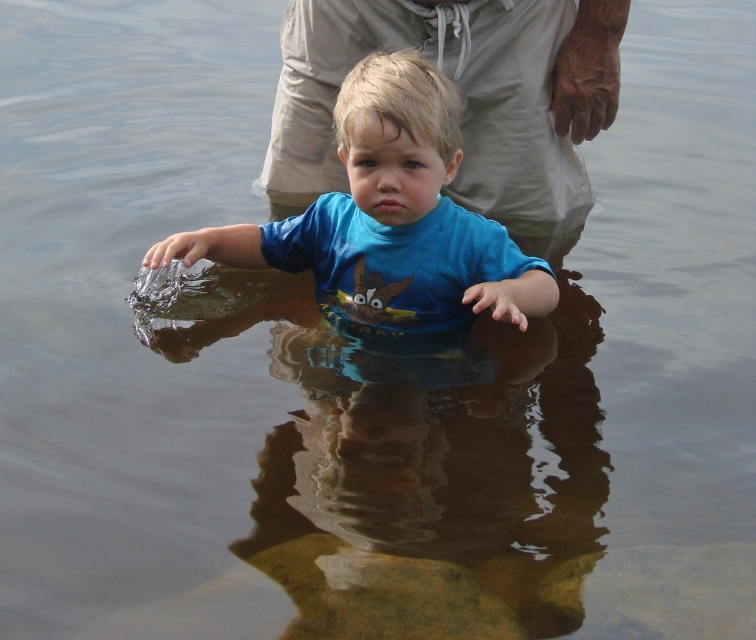
What do you see at coordinates (460, 99) in the screenshot?
I see `beige cotton pants at upper center` at bounding box center [460, 99].

Is beige cotton pants at upper center further to camera compared to blue matte shirt at center?

That is True.

Is point (538, 168) farther from camera compared to point (468, 257)?

Yes, it is behind point (468, 257).

Find the location of a particular element. The height and width of the screenshot is (640, 756). beige cotton pants at upper center is located at coordinates (460, 99).